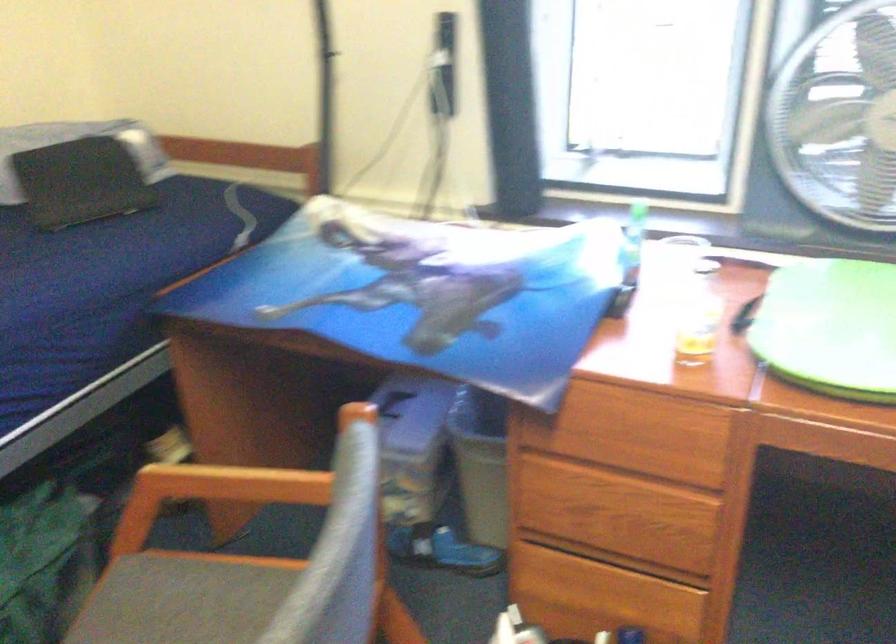
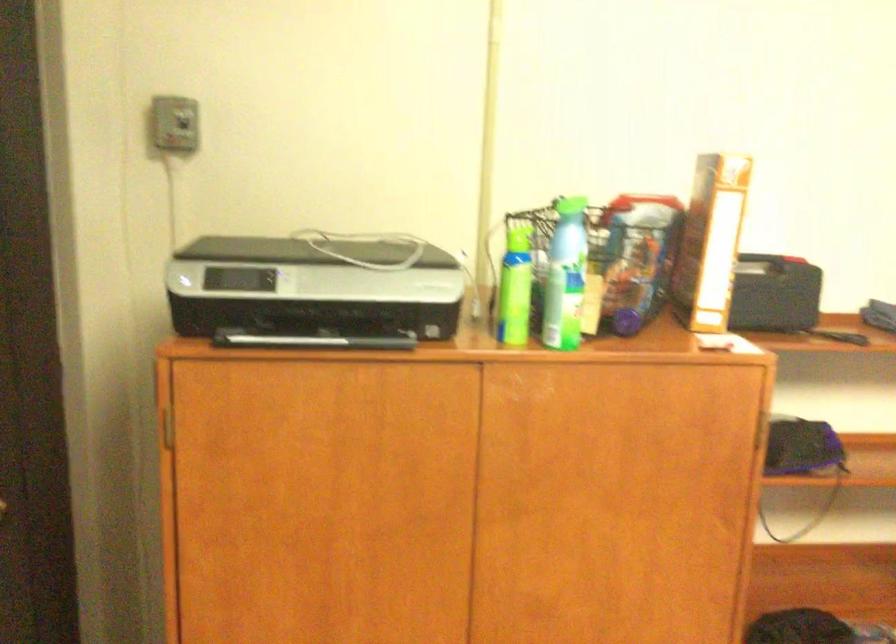
The images are taken continuously from a first-person perspective. In which direction is your viewpoint rotating?

The rotation direction of the camera is left-down.